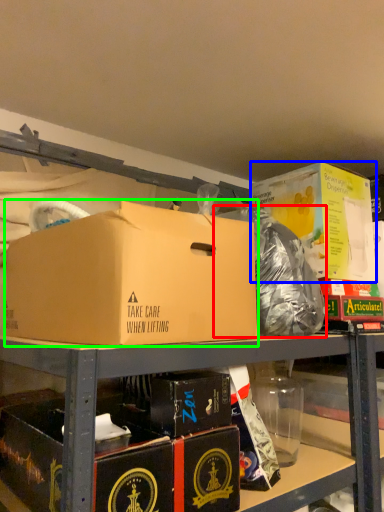
Question: Which is nearer to the garbage (highlighted by a red box)? box (highlighted by a blue box) or box (highlighted by a green box).

Choices:
 (A) box
 (B) box

Answer: (A)